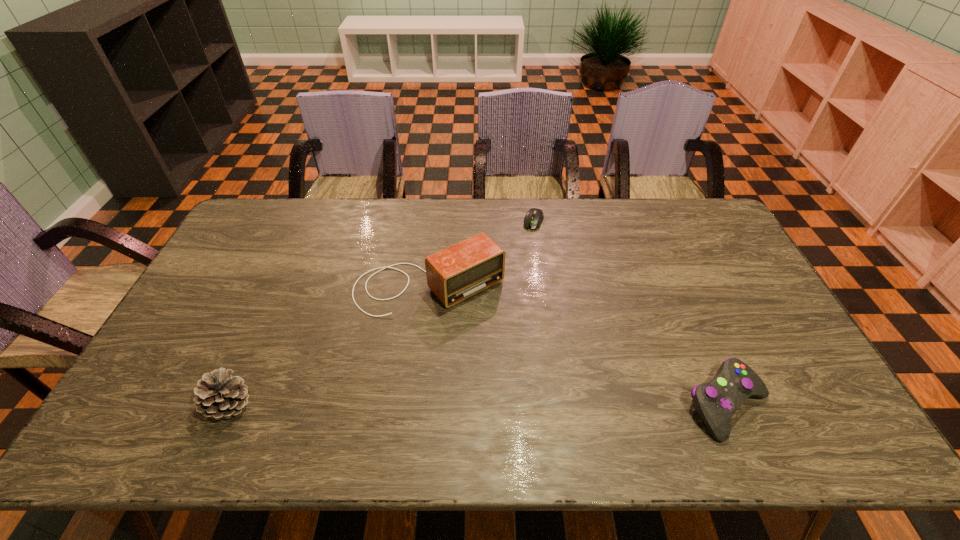
Identify the location of blank region between the third nearest object and the rightmost object. The width and height of the screenshot is (960, 540). (578, 346).

Where is `vacant region between the control and the radio receiver`? vacant region between the control and the radio receiver is located at coordinates (578, 346).

Identify the location of empty space between the control and the radio receiver. (578, 346).

Where is `free space that is in between the second object from right to left and the pinecone`? This screenshot has width=960, height=540. free space that is in between the second object from right to left and the pinecone is located at coordinates (382, 313).

Select which object is the closest to the radio receiver. Please provide its 2D coordinates. Your answer should be formatted as a tuple, i.e. [(x, y)], where the tuple contains the x and y coordinates of a point satisfying the conditions above.

[(534, 217)]

Select which object appears as the third closest to the rightmost object. Please provide its 2D coordinates. Your answer should be formatted as a tuple, i.e. [(x, y)], where the tuple contains the x and y coordinates of a point satisfying the conditions above.

[(220, 395)]

You are a GUI agent. You are given a task and a screenshot of the screen. Output one action in this format:
    pyautogui.click(x=<x>, y=<y>)
    Task: Click on the vacant area that satisfies the following two spatial constraints: 1. on the back side of the radio receiver; 2. on the left side of the shortest object
    
    Given the screenshot: What is the action you would take?
    (437, 221)